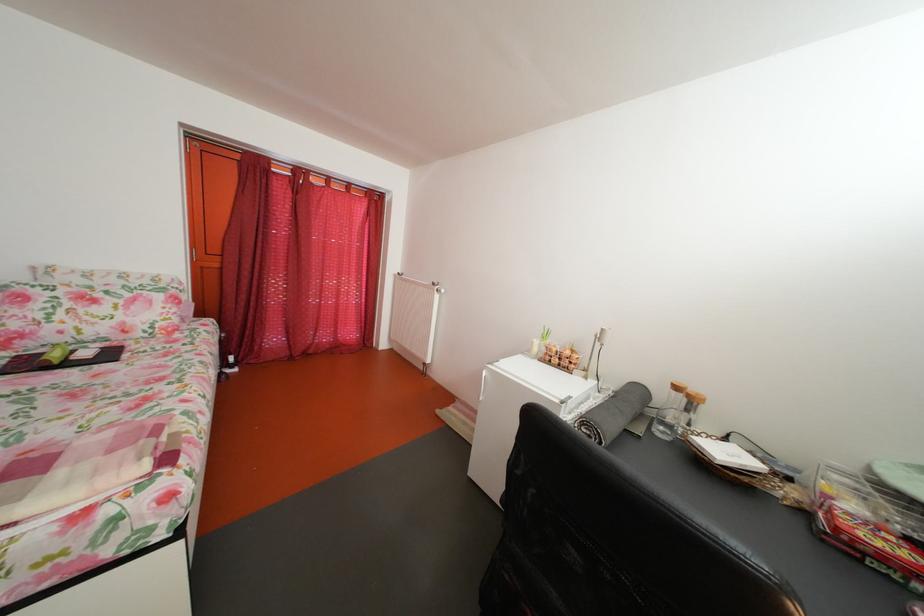
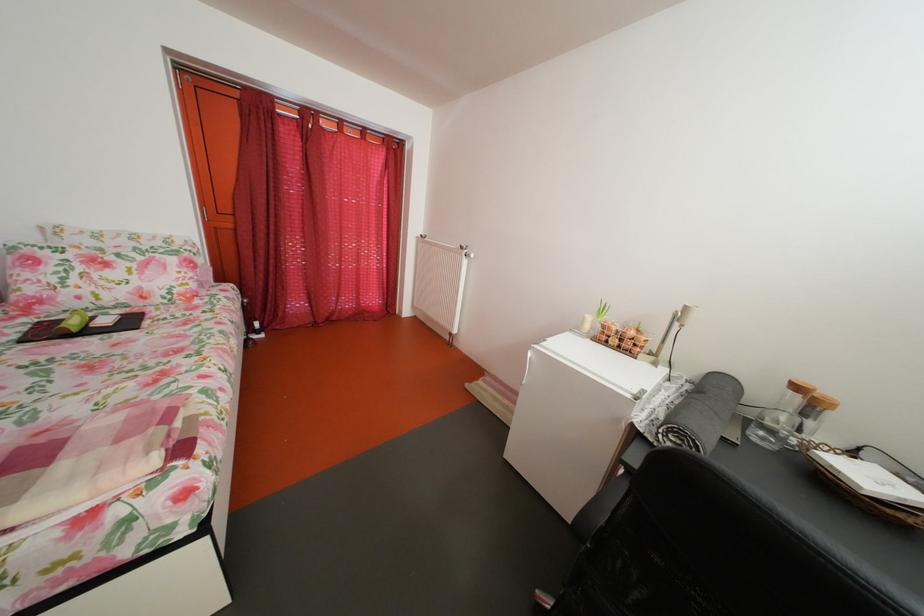
Locate, in the second image, the point that corresponds to point (736, 460) in the first image.

(880, 485)